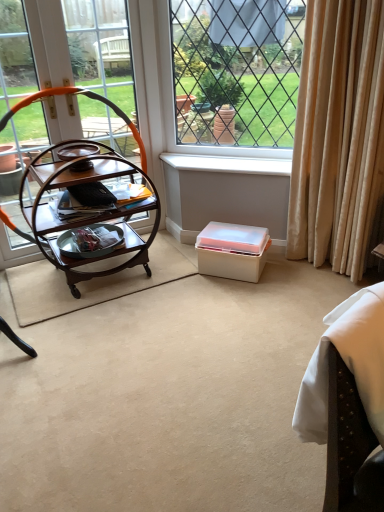
Question: Is white fabric swivel chair at lower right located within white plastic box at center?

Choices:
 (A) yes
 (B) no

Answer: (B)

Question: Is white plastic box at center taller than white fabric swivel chair at lower right?

Choices:
 (A) no
 (B) yes

Answer: (A)

Question: Are white plastic box at center and white fabric swivel chair at lower right making contact?

Choices:
 (A) no
 (B) yes

Answer: (A)

Question: Is white plastic box at center looking in the opposite direction of white fabric swivel chair at lower right?

Choices:
 (A) no
 (B) yes

Answer: (A)

Question: Is white plastic box at center outside white fabric swivel chair at lower right?

Choices:
 (A) no
 (B) yes

Answer: (B)

Question: Does white plastic box at center have a larger size compared to white fabric swivel chair at lower right?

Choices:
 (A) no
 (B) yes

Answer: (A)

Question: Is white plastic window sill at center positioned in front of white fabric swivel chair at lower right?

Choices:
 (A) no
 (B) yes

Answer: (A)

Question: From a real-world perspective, is white plastic window sill at center located beneath white fabric swivel chair at lower right?

Choices:
 (A) no
 (B) yes

Answer: (A)

Question: Are white plastic window sill at center and white fabric swivel chair at lower right beside each other?

Choices:
 (A) no
 (B) yes

Answer: (A)

Question: Is white plastic window sill at center outside of white fabric swivel chair at lower right?

Choices:
 (A) no
 (B) yes

Answer: (B)

Question: Considering the relative sizes of white plastic window sill at center and white fabric swivel chair at lower right in the image provided, is white plastic window sill at center wider than white fabric swivel chair at lower right?

Choices:
 (A) no
 (B) yes

Answer: (A)

Question: Is white plastic window sill at center facing towards white fabric swivel chair at lower right?

Choices:
 (A) yes
 (B) no

Answer: (B)

Question: Is wooden trolley at left closer to camera compared to white fabric swivel chair at lower right?

Choices:
 (A) no
 (B) yes

Answer: (A)